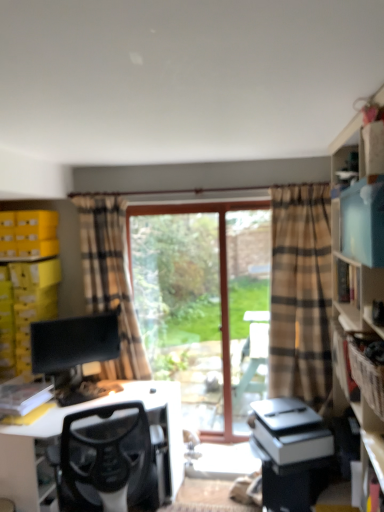
Question: Does matte blue shelf at right, which appears as the 1th shelf when viewed from the right, have a greater width compared to black mesh chair at lower left?

Choices:
 (A) no
 (B) yes

Answer: (A)

Question: Is matte blue shelf at right, the 1th shelf in the front-to-back sequence, bigger than black mesh chair at lower left?

Choices:
 (A) no
 (B) yes

Answer: (A)

Question: Considering the relative sizes of matte blue shelf at right, which appears as the second shelf when viewed from the back, and black mesh chair at lower left in the image provided, is matte blue shelf at right, which appears as the second shelf when viewed from the back, smaller than black mesh chair at lower left?

Choices:
 (A) no
 (B) yes

Answer: (B)

Question: Can you confirm if matte blue shelf at right, which is counted as the 2th shelf, starting from the left, is taller than black mesh chair at lower left?

Choices:
 (A) no
 (B) yes

Answer: (A)

Question: Is matte blue shelf at right, which is counted as the 2th shelf, starting from the left, at the left side of black mesh chair at lower left?

Choices:
 (A) no
 (B) yes

Answer: (A)

Question: Considering the relative positions of matte blue shelf at right, which appears as the 1th shelf when viewed from the right, and black mesh chair at lower left in the image provided, is matte blue shelf at right, which appears as the 1th shelf when viewed from the right, behind black mesh chair at lower left?

Choices:
 (A) yes
 (B) no

Answer: (B)

Question: Is brown cardboard crate at right not near yellow cardboard boxes at left, which appears as the 2th shelf when viewed from the right?

Choices:
 (A) no
 (B) yes

Answer: (B)

Question: Is the position of brown cardboard crate at right more distant than that of yellow cardboard boxes at left, which ranks as the 1th shelf in left-to-right order?

Choices:
 (A) yes
 (B) no

Answer: (B)

Question: Is brown cardboard crate at right aimed at yellow cardboard boxes at left, the 1th shelf viewed from the back?

Choices:
 (A) no
 (B) yes

Answer: (B)

Question: Is brown cardboard crate at right at the right side of yellow cardboard boxes at left, which ranks as the 1th shelf in left-to-right order?

Choices:
 (A) yes
 (B) no

Answer: (A)

Question: Can you confirm if brown cardboard crate at right is bigger than yellow cardboard boxes at left, which ranks as the 1th shelf in left-to-right order?

Choices:
 (A) no
 (B) yes

Answer: (A)

Question: Is brown cardboard crate at right not within yellow cardboard boxes at left, the 1th shelf viewed from the back?

Choices:
 (A) no
 (B) yes

Answer: (B)

Question: Considering the relative sizes of brown cardboard crate at right and clear glass window at center in the image provided, is brown cardboard crate at right shorter than clear glass window at center?

Choices:
 (A) yes
 (B) no

Answer: (A)